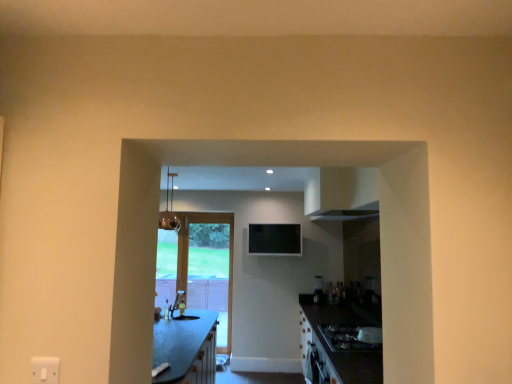
Describe the element at coordinates (319, 290) in the screenshot. This screenshot has height=384, width=512. I see `satin black blender at center` at that location.

This screenshot has height=384, width=512. What do you see at coordinates (352, 337) in the screenshot?
I see `black glossy gas stove at lower right` at bounding box center [352, 337].

This screenshot has width=512, height=384. In order to click on satin black blender at center in this screenshot , I will do `click(319, 290)`.

Is wooden glass door at center oriented towards satin black blender at center?

No, wooden glass door at center is not oriented towards satin black blender at center.

From the image's perspective, is wooden glass door at center located beneath satin black blender at center?

Correct, wooden glass door at center appears lower than satin black blender at center in the image.

Which is in front, point (209, 274) or point (322, 289)?

Positioned in front is point (322, 289).

Based on the photo, how many degrees apart are the facing directions of wooden glass door at center and satin black blender at center?

The angle between the facing direction of wooden glass door at center and the facing direction of satin black blender at center is 46.1 degrees.

Is black glossy gas stove at lower right taller or shorter than matte glass light fixture at upper center?

Considering their sizes, black glossy gas stove at lower right has less height than matte glass light fixture at upper center.

Is black glossy gas stove at lower right not near matte glass light fixture at upper center?

Yes, black glossy gas stove at lower right and matte glass light fixture at upper center are quite far apart.

Is point (331, 332) positioned after point (169, 220)?

That is False.

Is black glossy gas stove at lower right completely or partially outside of matte glass light fixture at upper center?

That's correct, black glossy gas stove at lower right is outside of matte glass light fixture at upper center.

Considering the relative sizes of matte glass light fixture at upper center and matte white sink at center in the image provided, is matte glass light fixture at upper center taller than matte white sink at center?

Yes.

Which is nearer, (x=178, y=220) or (x=184, y=293)?

The point (x=184, y=293) is in front.

Could you tell me if matte glass light fixture at upper center is turned towards matte white sink at center?

No.

From the picture: From a real-world perspective, relative to matte white sink at center, is satin black blender at center vertically above or below?

In terms of real-world spatial position, satin black blender at center is above matte white sink at center.

Between satin black blender at center and matte white sink at center, which one has smaller width?

With smaller width is satin black blender at center.

Which of these two, satin black blender at center or matte white sink at center, stands taller?

With more height is satin black blender at center.

Is matte white sink at center surrounded by satin black blender at center?

No.

Is satin black blender at center facing away from wooden glass door at center?

No, satin black blender at center's orientation is not away from wooden glass door at center.

Between point (322, 291) and point (205, 228), which one is positioned in front?

The point (322, 291) is more forward.

Is satin black blender at center touching wooden glass door at center?

No.

Considering the relative positions of black glossy gas stove at lower right and matte white sink at center in the image provided, is black glossy gas stove at lower right to the left of matte white sink at center from the viewer's perspective?

Incorrect, black glossy gas stove at lower right is not on the left side of matte white sink at center.

This screenshot has width=512, height=384. In order to click on gas stove that appears on the right of matte white sink at center in this screenshot , I will do `click(352, 337)`.

Does point (347, 349) come behind point (188, 318)?

No, (347, 349) is closer to viewer.

From the image's perspective, is black glossy gas stove at lower right located beneath matte white sink at center?

Indeed, from the image's perspective, black glossy gas stove at lower right is shown beneath matte white sink at center.

How different are the orientations of matte glass light fixture at upper center and satin black blender at center in degrees?

The angle between the facing direction of matte glass light fixture at upper center and the facing direction of satin black blender at center is 46.3 degrees.

From a real-world perspective, is matte glass light fixture at upper center above or below satin black blender at center?

matte glass light fixture at upper center is situated higher than satin black blender at center in the real world.

Is matte glass light fixture at upper center to the left of satin black blender at center from the viewer's perspective?

Indeed, matte glass light fixture at upper center is positioned on the left side of satin black blender at center.

Is matte glass light fixture at upper center touching satin black blender at center?

No, matte glass light fixture at upper center is not with satin black blender at center.

This screenshot has height=384, width=512. I want to click on appliance above the wooden glass door at center (from the image's perspective), so click(x=319, y=290).

You are a GUI agent. You are given a task and a screenshot of the screen. Output one action in this format:
    pyautogui.click(x=<x>, y=<y>)
    Task: Click on the gas stove that appears on the right of matte glass light fixture at upper center
    This screenshot has height=384, width=512.
    Given the screenshot: What is the action you would take?
    pyautogui.click(x=352, y=337)

Considering their positions, is black glossy gas stove at lower right positioned further to matte glass light fixture at upper center than satin black blender at center?

black glossy gas stove at lower right lies further to matte glass light fixture at upper center than the other object.

In the scene shown: Which object lies nearer to the anchor point satin black blender at center, matte white sink at center or matte glass light fixture at upper center?

The object closer to satin black blender at center is matte white sink at center.

Considering their positions, is satin black blender at center positioned closer to wooden glass door at center than black glossy gas stove at lower right?

satin black blender at center is closer to wooden glass door at center.

Based on their spatial positions, is satin black blender at center or matte glass light fixture at upper center closer to black glossy gas stove at lower right?

satin black blender at center lies closer to black glossy gas stove at lower right than the other object.

Based on their spatial positions, is black glossy gas stove at lower right or matte white sink at center further from satin black blender at center?

matte white sink at center.

Based on the photo, from the image, which object appears to be nearer to satin black blender at center, matte glass light fixture at upper center or black glossy gas stove at lower right?

Among the two, black glossy gas stove at lower right is located nearer to satin black blender at center.

Based on the photo, estimate the real-world distances between objects in this image. Which object is closer to matte white sink at center, satin black blender at center or wooden glass door at center?

wooden glass door at center lies closer to matte white sink at center than the other object.

Looking at the image, which one is located further to matte glass light fixture at upper center, black glossy gas stove at lower right or wooden glass door at center?

black glossy gas stove at lower right is positioned further to the anchor matte glass light fixture at upper center.

Where is `door situated between matte white sink at center and satin black blender at center from left to right`? This screenshot has height=384, width=512. door situated between matte white sink at center and satin black blender at center from left to right is located at coordinates (207, 267).

The width and height of the screenshot is (512, 384). What are the coordinates of `sink located between black glossy gas stove at lower right and satin black blender at center in the depth direction` in the screenshot? It's located at (179, 307).

Identify the location of light fixture between black glossy gas stove at lower right and satin black blender at center from front to back. The image size is (512, 384). (169, 209).

The width and height of the screenshot is (512, 384). In order to click on light fixture between black glossy gas stove at lower right and wooden glass door at center along the z-axis in this screenshot , I will do `click(169, 209)`.